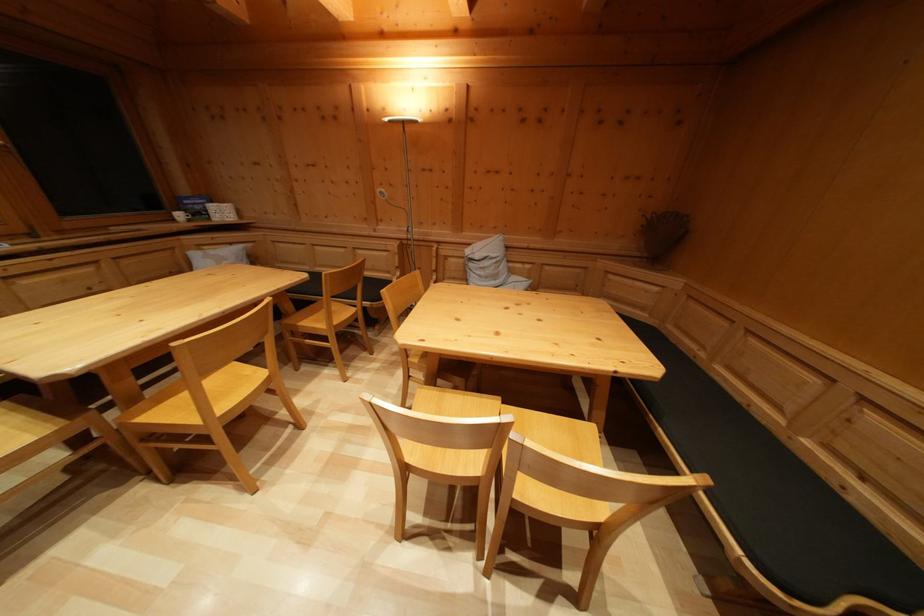
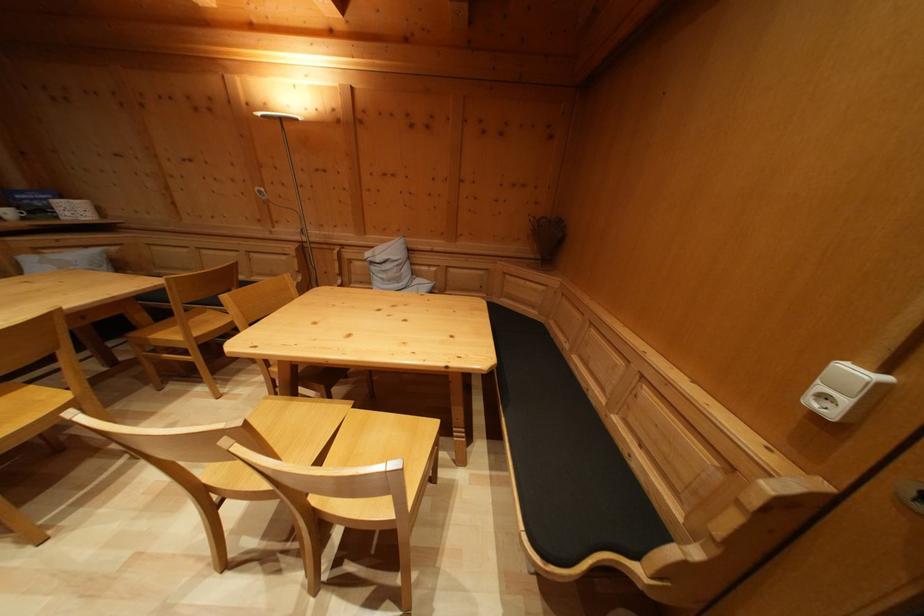
Question: The images are taken continuously from a first-person perspective. In which direction is your viewpoint rotating?

Choices:
 (A) Left
 (B) Right
 (C) Up
 (D) Down

Answer: (B)